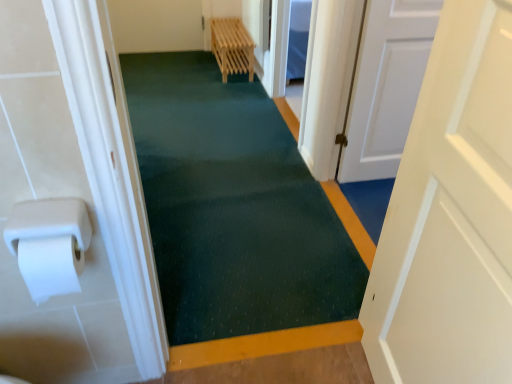
Where is `green textured carpet at center`? The height and width of the screenshot is (384, 512). green textured carpet at center is located at coordinates (233, 206).

Locate an element on the screen. This screenshot has height=384, width=512. white matte door at right, which is the second door in right-to-left order is located at coordinates (450, 216).

This screenshot has height=384, width=512. Identify the location of wooden rack at center. (232, 47).

Is white matte paper towel at left inside the boundaries of green textured carpet at center, or outside?

white matte paper towel at left lies outside green textured carpet at center.

Which of these two, white matte paper towel at left or green textured carpet at center, is thinner?

white matte paper towel at left is thinner.

I want to click on bath mat above the white matte paper towel at left (from the image's perspective), so click(x=233, y=206).

Would you say white matte door at right, acting as the 1th door starting from the front, is outside green textured carpet at center?

Indeed, white matte door at right, acting as the 1th door starting from the front, is completely outside green textured carpet at center.

Considering the relative sizes of white matte door at right, the second door when ordered from back to front, and green textured carpet at center in the image provided, is white matte door at right, the second door when ordered from back to front, wider than green textured carpet at center?

No, white matte door at right, the second door when ordered from back to front, is not wider than green textured carpet at center.

The image size is (512, 384). Identify the location of door in front of the green textured carpet at center. [x=450, y=216].

Which is less distant, (222, 22) or (368, 117)?

Point (222, 22) appears to be farther away from the viewer than point (368, 117).

Based on their sizes in the image, would you say wooden rack at center is bigger or smaller than white matte door at center, positioned as the second door in left-to-right order?

In the image, wooden rack at center appears to be larger than white matte door at center, positioned as the second door in left-to-right order.

Considering the relative sizes of wooden rack at center and white matte door at center, positioned as the second door in left-to-right order, in the image provided, is wooden rack at center thinner than white matte door at center, positioned as the second door in left-to-right order,?

No, wooden rack at center is not thinner than white matte door at center, positioned as the second door in left-to-right order.

Do you think wooden rack at center is within white matte door at center, positioned as the second door in left-to-right order, or outside of it?

The correct answer is: outside.

From the picture: Which of these two, white matte door at right, which is the 1th door from left to right, or white matte paper towel at left, stands taller?

Standing taller between the two is white matte door at right, which is the 1th door from left to right.

Visually, is white matte door at right, acting as the 1th door starting from the front, positioned to the left or to the right of white matte paper towel at left?

Based on their positions, white matte door at right, acting as the 1th door starting from the front, is located to the right of white matte paper towel at left.

Between white matte door at right, the second door when ordered from back to front, and white matte paper towel at left, which one has larger size?

Bigger between the two is white matte door at right, the second door when ordered from back to front.

Is point (502, 19) closer or farther from the camera than point (46, 251)?

Point (502, 19).

In terms of height, does white matte door at center, marked as the second door in a front-to-back arrangement, look taller or shorter compared to wooden rack at center?

white matte door at center, marked as the second door in a front-to-back arrangement, is taller than wooden rack at center.

Is white matte door at center, marked as the second door in a front-to-back arrangement, positioned behind wooden rack at center?

No, white matte door at center, marked as the second door in a front-to-back arrangement, is closer to the camera.

Between point (362, 163) and point (248, 41), which one is positioned behind?

The point (248, 41) is behind.

Is white matte door at center, positioned as the second door in left-to-right order, located outside wooden rack at center?

white matte door at center, positioned as the second door in left-to-right order, lies outside wooden rack at center's area.

Does point (414, 71) lie behind point (415, 378)?

Yes, it is.

Locate an element on the screen. door on the left side of white matte door at center, positioned as the second door in left-to-right order is located at coordinates (450, 216).

Between white matte door at center, which is counted as the 1th door, starting from the right, and white matte door at right, acting as the 1th door starting from the front, which one appears on the left side from the viewer's perspective?

white matte door at right, acting as the 1th door starting from the front.

From a real-world perspective, is white matte door at center, which ranks as the first door in back-to-front order, physically above white matte door at right, which is the 1th door from left to right?

No, from a real-world perspective, white matte door at center, which ranks as the first door in back-to-front order, is not over white matte door at right, which is the 1th door from left to right

Is white matte paper towel at left next to white matte door at right, acting as the 1th door starting from the front?

No, white matte paper towel at left is not in contact with white matte door at right, acting as the 1th door starting from the front.

The height and width of the screenshot is (384, 512). I want to click on paper towel behind the white matte door at right, the second door when ordered from back to front, so click(49, 244).

Can you confirm if white matte paper towel at left is shorter than white matte door at right, which is the second door in right-to-left order?

Indeed, white matte paper towel at left has a lesser height compared to white matte door at right, which is the second door in right-to-left order.

There is a green textured carpet at center. Where is `paper towel above it (from a real-world perspective)`? paper towel above it (from a real-world perspective) is located at coordinates (49, 244).

The image size is (512, 384). I want to click on door in front of the green textured carpet at center, so click(x=450, y=216).

Looking at the image, which one is located further to white matte paper towel at left, green textured carpet at center or white matte door at right, acting as the 1th door starting from the front?

green textured carpet at center.

Based on their spatial positions, is green textured carpet at center or white matte door at center, positioned as the second door in left-to-right order, further from wooden rack at center?

white matte door at center, positioned as the second door in left-to-right order, lies further to wooden rack at center than the other object.

From the image, which object appears to be nearer to white matte door at right, which is the 1th door from left to right, white matte paper towel at left or green textured carpet at center?

white matte paper towel at left.

From the image, which object appears to be nearer to white matte door at center, positioned as the second door in left-to-right order, white matte door at right, the second door when ordered from back to front, or green textured carpet at center?

green textured carpet at center lies closer to white matte door at center, positioned as the second door in left-to-right order, than the other object.

Which object lies further to the anchor point wooden rack at center, green textured carpet at center or white matte paper towel at left?

Based on the image, white matte paper towel at left appears to be further to wooden rack at center.

Based on their spatial positions, is white matte door at center, marked as the second door in a front-to-back arrangement, or wooden rack at center further from green textured carpet at center?

Among the two, wooden rack at center is located further to green textured carpet at center.

Based on their spatial positions, is white matte door at center, which is counted as the 1th door, starting from the right, or white matte paper towel at left closer to wooden rack at center?

white matte door at center, which is counted as the 1th door, starting from the right, is positioned closer to the anchor wooden rack at center.

Based on their spatial positions, is white matte paper towel at left or white matte door at right, which is the 1th door from left to right, further from white matte door at center, which is counted as the 1th door, starting from the right?

white matte paper towel at left lies further to white matte door at center, which is counted as the 1th door, starting from the right, than the other object.

The height and width of the screenshot is (384, 512). In order to click on paper towel between white matte door at right, acting as the 1th door starting from the front, and wooden rack at center in the front-back direction in this screenshot , I will do `click(49, 244)`.

Where is `bath mat between white matte door at right, which is the 1th door from left to right, and white matte door at center, positioned as the second door in left-to-right order, in the front-back direction`? The height and width of the screenshot is (384, 512). bath mat between white matte door at right, which is the 1th door from left to right, and white matte door at center, positioned as the second door in left-to-right order, in the front-back direction is located at coordinates (233, 206).

This screenshot has height=384, width=512. What are the coordinates of `door positioned between green textured carpet at center and wooden rack at center from near to far` in the screenshot? It's located at (386, 85).

Find the location of a particular element. paper towel located between white matte door at right, the second door when ordered from back to front, and white matte door at center, which ranks as the first door in back-to-front order, in the depth direction is located at coordinates (49, 244).